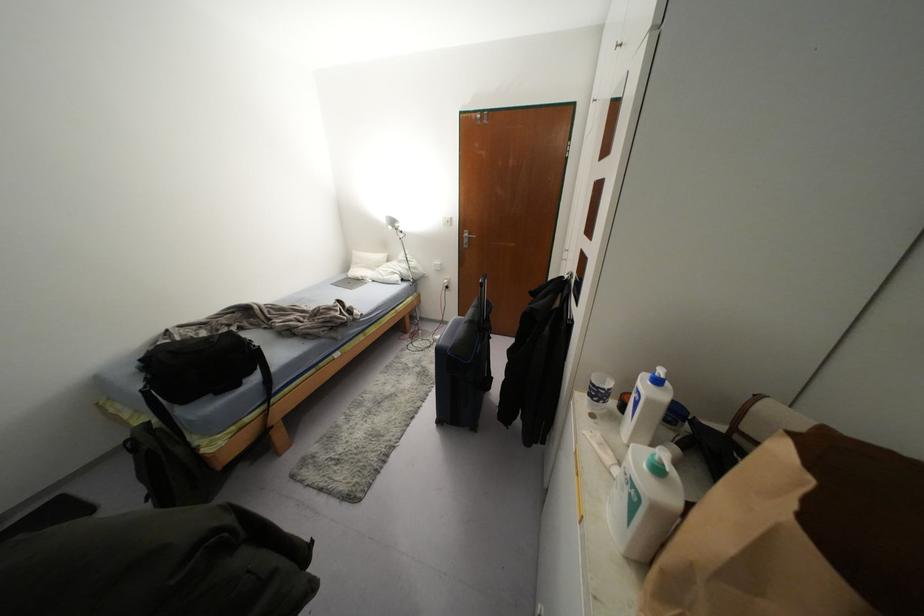
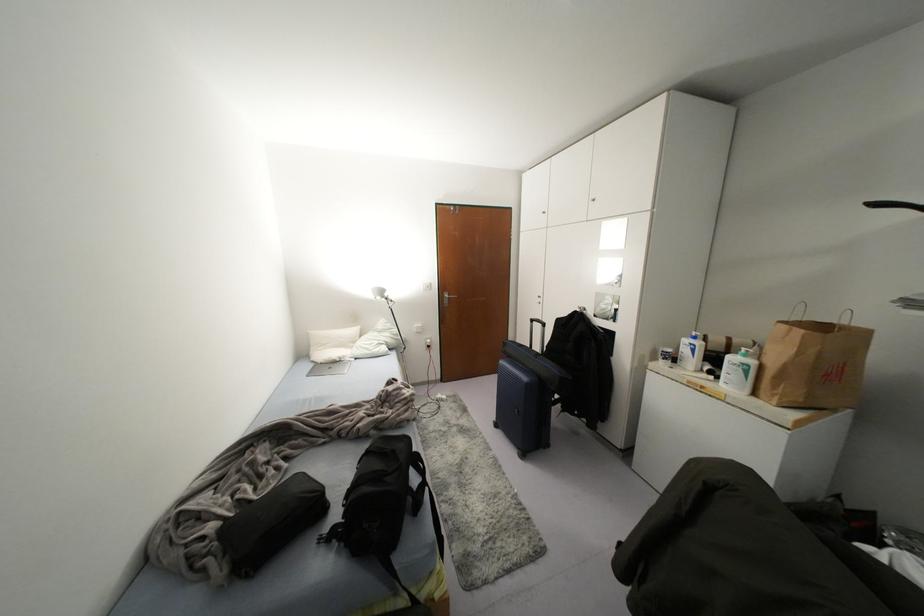
Find the pixel in the second image that matches [465,233] in the first image.

(445, 296)